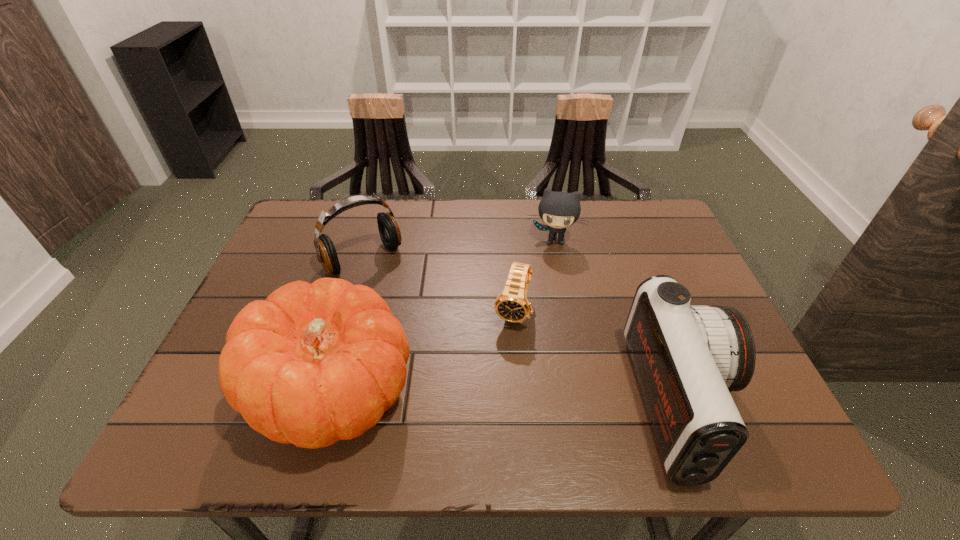
Locate an element on the screen. The image size is (960, 540). free point located on the front-facing side of the kitten is located at coordinates (544, 310).

Locate an element on the screen. This screenshot has width=960, height=540. free spot located on the front-facing side of the kitten is located at coordinates (540, 360).

Find the location of a particular element. The width and height of the screenshot is (960, 540). vacant space positioned 0.160m on the face of the third object from right to left is located at coordinates (492, 392).

Find the location of a particular element. vacant space located on the face of the third object from right to left is located at coordinates pos(493,388).

The width and height of the screenshot is (960, 540). In order to click on free space located 0.180m on the face of the third object from right to left in this screenshot , I will do `click(490, 400)`.

Identify the location of free space located on the ear cups of the headset. The height and width of the screenshot is (540, 960). (398, 298).

The width and height of the screenshot is (960, 540). I want to click on vacant region located on the ear cups of the headset, so click(x=468, y=381).

The height and width of the screenshot is (540, 960). In order to click on free space located on the ear cups of the headset in this screenshot , I will do `click(398, 298)`.

Identify the location of kitten present at the far edge. The width and height of the screenshot is (960, 540). (558, 210).

In order to click on headset located at the far edge in this screenshot , I will do `click(389, 231)`.